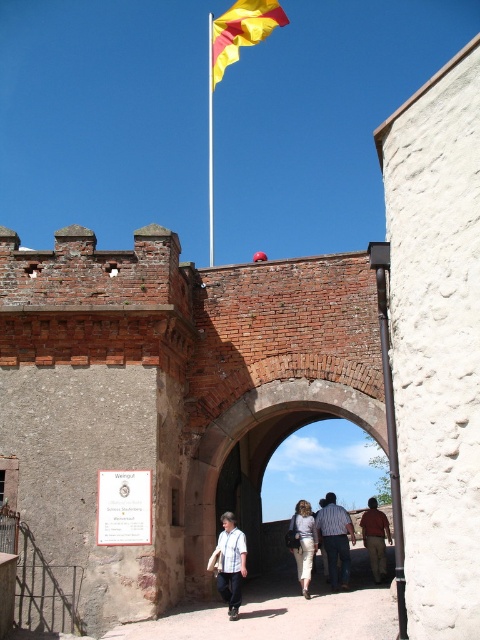
Is brick wall at center bigger than white shirt at center?

Yes, brick wall at center is bigger than white shirt at center.

Is brick wall at center to the left of white shirt at center from the viewer's perspective?

Incorrect, brick wall at center is not on the left side of white shirt at center.

Is point (57, 506) farther from camera compared to point (235, 540)?

No, it is not.

At what (x,y) coordinates should I click in order to perform the action: click on brick wall at center. Please return your answer as a coordinate pair (x, y). This screenshot has height=640, width=480. Looking at the image, I should click on (169, 394).

Is white shirt at center to the left of striped cotton shirt at center from the viewer's perspective?

Indeed, white shirt at center is positioned on the left side of striped cotton shirt at center.

Find the location of a particular element. This screenshot has height=640, width=480. white shirt at center is located at coordinates (229, 563).

Who is more forward, (228, 561) or (322, 518)?

Point (228, 561)

This screenshot has width=480, height=640. I want to click on white shirt at center, so click(229, 563).

Between point (228, 32) and point (337, 518), which one is positioned behind?

The point (228, 32) is more distant.

Who is taller, yellowmaterial/textureflag at upper center or striped cotton shirt at center?

yellowmaterial/textureflag at upper center

Does point (230, 17) come behind point (336, 564)?

Yes, it is.

Locate an element on the screen. The image size is (480, 640). yellowmaterial/textureflag at upper center is located at coordinates (240, 32).